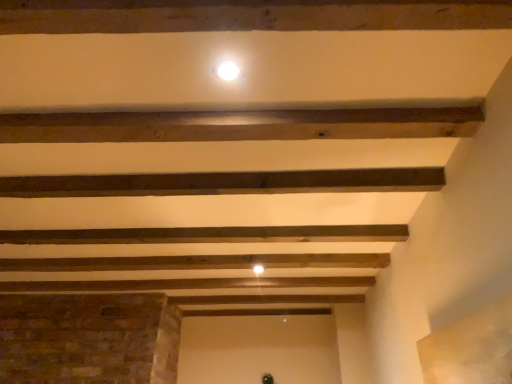
The width and height of the screenshot is (512, 384). Find the location of `white glossy light at upper center`. white glossy light at upper center is located at coordinates (228, 71).

The image size is (512, 384). Describe the element at coordinates (228, 71) in the screenshot. I see `white glossy light at upper center` at that location.

Find the location of a particular element. white glossy light at upper center is located at coordinates (228, 71).